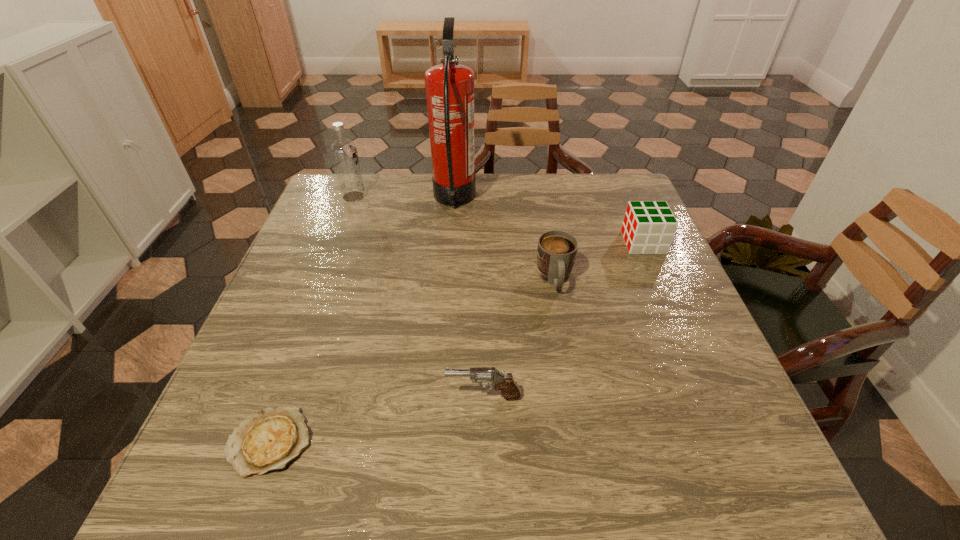
This screenshot has width=960, height=540. Find the location of `fire extinguisher`. fire extinguisher is located at coordinates (449, 87).

Where is `the second tallest object`? The height and width of the screenshot is (540, 960). the second tallest object is located at coordinates (343, 151).

At what (x,y) coordinates should I click in order to perform the action: click on the second object from right to left. Please return your answer as a coordinate pair (x, y). Looking at the image, I should click on (556, 252).

What are the coordinates of `mug` in the screenshot? It's located at (556, 252).

Identify the location of cube. The height and width of the screenshot is (540, 960). click(648, 227).

I want to click on the rightmost object, so click(x=648, y=227).

What are the coordinates of `the fifth farthest object` in the screenshot? It's located at (510, 390).

Find the location of a particular element. the shortest object is located at coordinates (268, 441).

Identify the location of the nearest object. Image resolution: width=960 pixels, height=540 pixels. (268, 441).

Identify the location of free spot located 0.230m on the front-facing side of the fire extinguisher. [x=554, y=200].